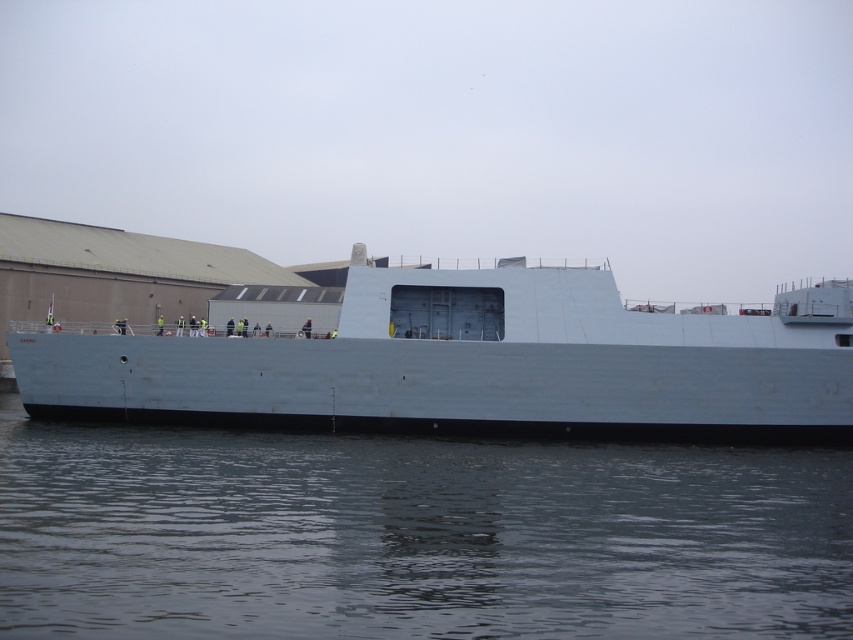
Question: Among these objects, which one is farthest from the camera?

Choices:
 (A) white matte ship at center
 (B) gray matte water at lower center

Answer: (A)

Question: Is gray matte water at lower center to the right of white matte ship at center from the viewer's perspective?

Choices:
 (A) no
 (B) yes

Answer: (B)

Question: Which point appears closest to the camera in this image?

Choices:
 (A) (165, 515)
 (B) (804, 364)

Answer: (A)

Question: Can you confirm if gray matte water at lower center is positioned to the right of white matte ship at center?

Choices:
 (A) yes
 (B) no

Answer: (A)

Question: Which object appears farthest from the camera in this image?

Choices:
 (A) white matte ship at center
 (B) gray matte water at lower center

Answer: (A)

Question: Considering the relative positions of gray matte water at lower center and white matte ship at center in the image provided, where is gray matte water at lower center located with respect to white matte ship at center?

Choices:
 (A) right
 (B) left

Answer: (A)